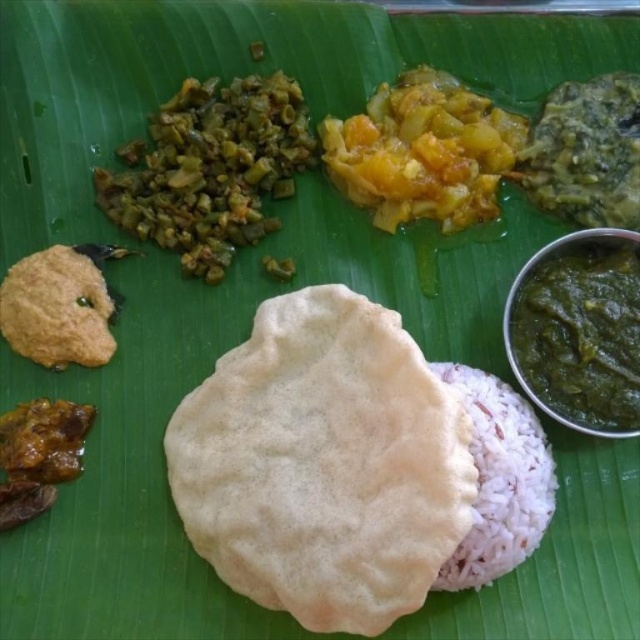
Does yellow-orange mashed food at center have a smaller size compared to brown crumbly food at lower left?

No.

Can you confirm if yellow-orange mashed food at center is bigger than brown crumbly food at lower left?

Yes.

Identify the location of yellow-orange mashed food at center. The image size is (640, 640). (422, 150).

Identify the location of yellow-orange mashed food at center. This screenshot has width=640, height=640. (422, 150).

From the picture: Which is more to the right, white soft flatbread at center or brown crumbly paste at upper left?

white soft flatbread at center

Is point (387, 563) positioned after point (24, 310)?

No.

The width and height of the screenshot is (640, 640). Describe the element at coordinates (323, 464) in the screenshot. I see `white soft flatbread at center` at that location.

I want to click on white soft flatbread at center, so click(323, 464).

Does point (269, 140) lie in front of point (595, 321)?

No, it is behind (595, 321).

Find the location of a particular element. greenish-brown textured vegetable at upper left is located at coordinates (211, 168).

Is point (186, 192) less distant than point (636, 248)?

No, it is behind (636, 248).

Locate an element on the screen. This screenshot has width=640, height=640. greenish-brown textured vegetable at upper left is located at coordinates (211, 168).